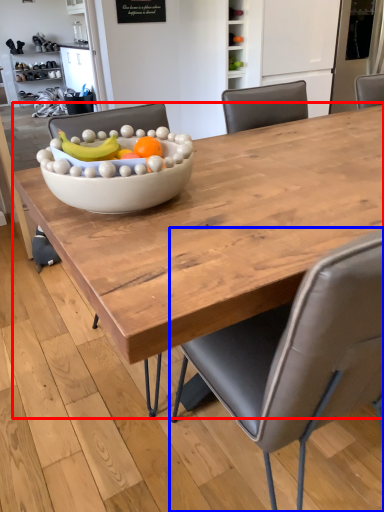
Question: Which object appears closest to the camera in this image, coffee table (highlighted by a red box) or chair (highlighted by a blue box)?

Choices:
 (A) coffee table
 (B) chair

Answer: (B)